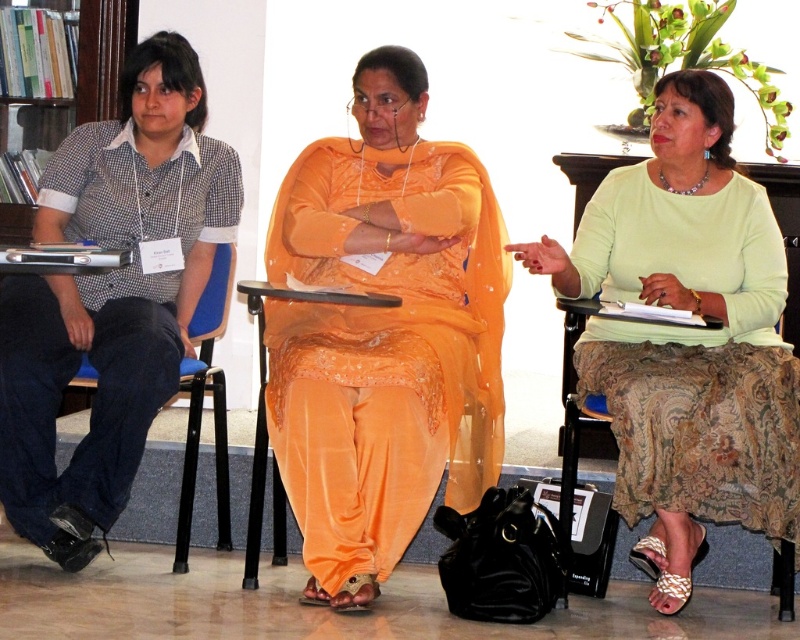
From the picture: You are standing at the point labeled as point (42, 196) and want to move to the point labeled as point (372, 564). Is the destination point in front of you or behind you?

The destination point labeled as point (372, 564) is in front of the starting point labeled as point (42, 196), so it is in front of you.

You are an event planner arranging a photo shoot for the attendees of the conference. You need to ensure that the orange silk dress at center and the checkered fabric shirt at left are visible in the photo. Based on their positions, which one is closer to the camera?

The orange silk dress at center is positioned under the checkered fabric shirt at left, meaning it is closer to the camera. Therefore, the orange silk dress at center will be more visible in the photo.